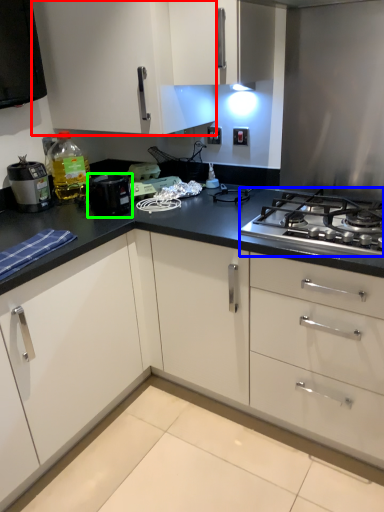
Question: Which object is the farthest from cabinetry (highlighted by a red box)? Choose among these: gas stove (highlighted by a blue box) or kitchen appliance (highlighted by a green box).

Choices:
 (A) gas stove
 (B) kitchen appliance

Answer: (A)